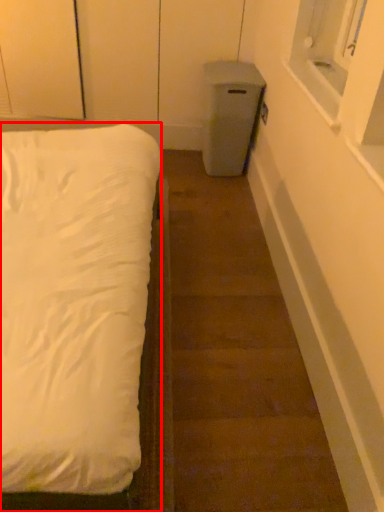
Question: From the image's perspective, what is the correct spatial positioning of bed (annotated by the red box) in reference to stairwell?

Choices:
 (A) above
 (B) below

Answer: (A)